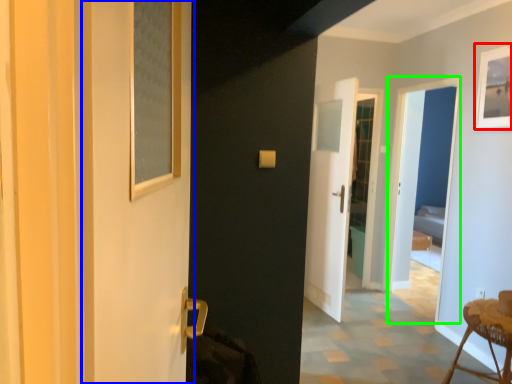
Question: Which is nearer to the picture frame (highlighted by a red box)? screen door (highlighted by a blue box) or screen door (highlighted by a green box).

Choices:
 (A) screen door
 (B) screen door

Answer: (B)